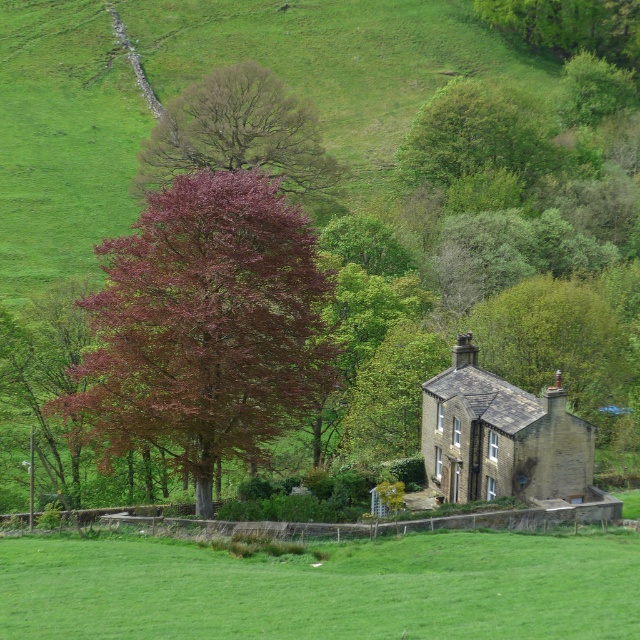
Describe the element at coordinates (324, 588) in the screenshot. I see `green grass at lower center` at that location.

Is green grass at lower center positioned at the back of smooth reddish-brown tree at upper center?

No, it is not.

Describe the element at coordinates (324, 588) in the screenshot. I see `green grass at lower center` at that location.

You are a GUI agent. You are given a task and a screenshot of the screen. Output one action in this format:
    pyautogui.click(x=<x>, y=<y>)
    Task: Click on the green grass at lower center
    
    Given the screenshot: What is the action you would take?
    pyautogui.click(x=324, y=588)

Is green grass at lower center above dark red leafy tree at upper left?

Actually, green grass at lower center is below dark red leafy tree at upper left.

Does green grass at lower center have a lesser width compared to dark red leafy tree at upper left?

No, green grass at lower center is not thinner than dark red leafy tree at upper left.

The width and height of the screenshot is (640, 640). What do you see at coordinates (324, 588) in the screenshot?
I see `green grass at lower center` at bounding box center [324, 588].

At what (x,y) coordinates should I click in order to perform the action: click on green grass at lower center. Please return your answer as a coordinate pair (x, y). Looking at the image, I should click on (324, 588).

Is green grass at lower center to the left of brown stone cottage at center-right from the viewer's perspective?

Yes, green grass at lower center is to the left of brown stone cottage at center-right.

Between point (346, 572) and point (436, 468), which one is positioned behind?

Positioned behind is point (436, 468).

This screenshot has width=640, height=640. What do you see at coordinates (324, 588) in the screenshot? I see `green grass at lower center` at bounding box center [324, 588].

Image resolution: width=640 pixels, height=640 pixels. What are the coordinates of `green grass at lower center` in the screenshot? It's located at point(324,588).